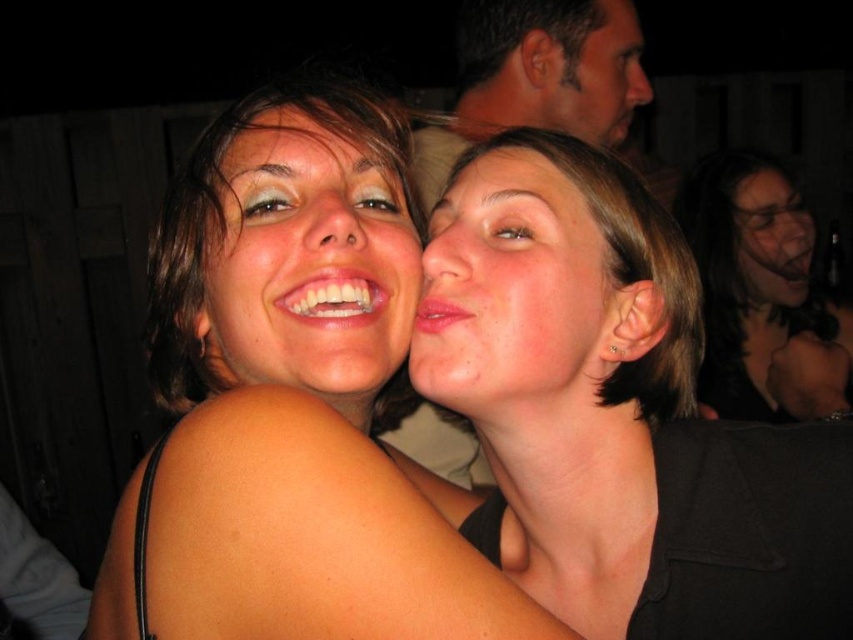
Question: Considering the real-world distances, which object is closest to the matte black hair at center?

Choices:
 (A) smooth black hair at upper right
 (B) matte skin at center

Answer: (B)

Question: Which point is farther to the camera?

Choices:
 (A) (213, 216)
 (B) (442, 342)
 (C) (170, 545)
 (D) (752, 236)

Answer: (D)

Question: Does matte skin face at upper center lie behind matte skin face at upper right?

Choices:
 (A) yes
 (B) no

Answer: (A)

Question: Is matte skin at center below matte skin face at upper center?

Choices:
 (A) no
 (B) yes

Answer: (B)

Question: Which object is the farthest from the matte skin face at upper right?

Choices:
 (A) matte skin face at center
 (B) matte skin at center
 (C) matte black hair at center

Answer: (A)

Question: Does smooth skin face at center have a lesser width compared to matte skin face at upper center?

Choices:
 (A) no
 (B) yes

Answer: (B)